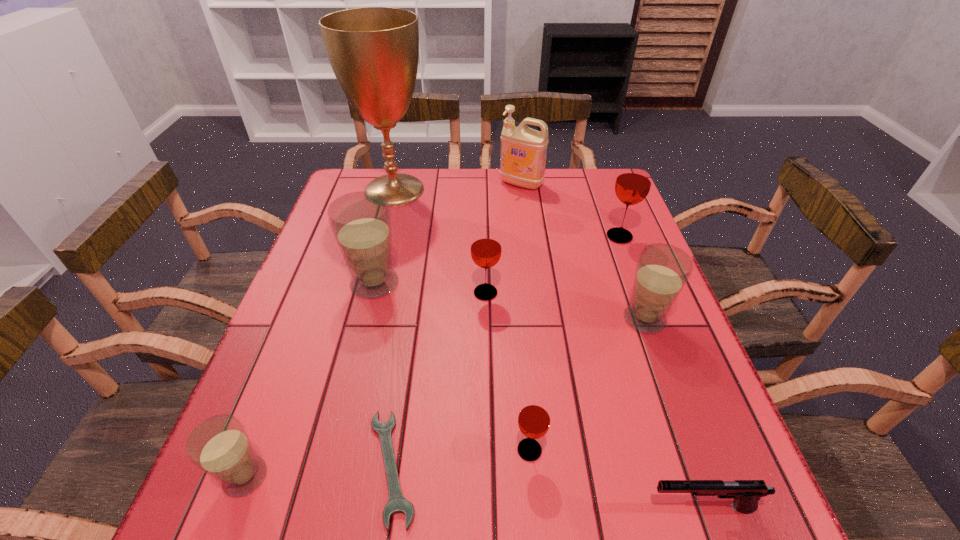
Where is `free space that is in between the farthest glass and the smallest red glass`? free space that is in between the farthest glass and the smallest red glass is located at coordinates (574, 343).

Where is `vacant space that is in between the second blue glass from left to right and the leftmost red glass`? This screenshot has height=540, width=960. vacant space that is in between the second blue glass from left to right and the leftmost red glass is located at coordinates 430,288.

At what (x,y) coordinates should I click in order to perform the action: click on vacant point located between the biggest blue glass and the wrench. Please return your answer as a coordinate pair (x, y). The image size is (960, 540). Looking at the image, I should click on (383, 375).

You are a GUI agent. You are given a task and a screenshot of the screen. Output one action in this format:
    pyautogui.click(x=<x>, y=<y>)
    Task: Click on the object that stands as the fourth closest to the nearest blue glass
    This screenshot has height=540, width=960.
    Given the screenshot: What is the action you would take?
    pyautogui.click(x=486, y=248)

Identify which object is the ninth closest to the detergent. Please provide its 2D coordinates. Your answer should be formatted as a tuple, i.e. [(x, y)], where the tuple contains the x and y coordinates of a point satisfying the conditions above.

[(219, 446)]

Point out which glass is positioned as the fifth nearest to the smallest blue glass. Please provide its 2D coordinates. Your answer should be formatted as a tuple, i.e. [(x, y)], where the tuple contains the x and y coordinates of a point satisfying the conditions above.

[(633, 182)]

Identify which glass is the closest to the sixth object from right to left. Please provide its 2D coordinates. Your answer should be formatted as a tuple, i.e. [(x, y)], where the tuple contains the x and y coordinates of a point satisfying the conditions above.

[(361, 221)]

This screenshot has height=540, width=960. Find the location of `red glass that is the second closest to the leftmost red glass`. red glass that is the second closest to the leftmost red glass is located at coordinates (534, 418).

Choose which red glass is the nearest neighbor to the fifth glass from right to left. Please provide its 2D coordinates. Your answer should be formatted as a tuple, i.e. [(x, y)], where the tuple contains the x and y coordinates of a point satisfying the conditions above.

[(486, 248)]

Locate an element on the screen. The image size is (960, 540). blue glass object that ranks as the closest to the shortest object is located at coordinates (219, 446).